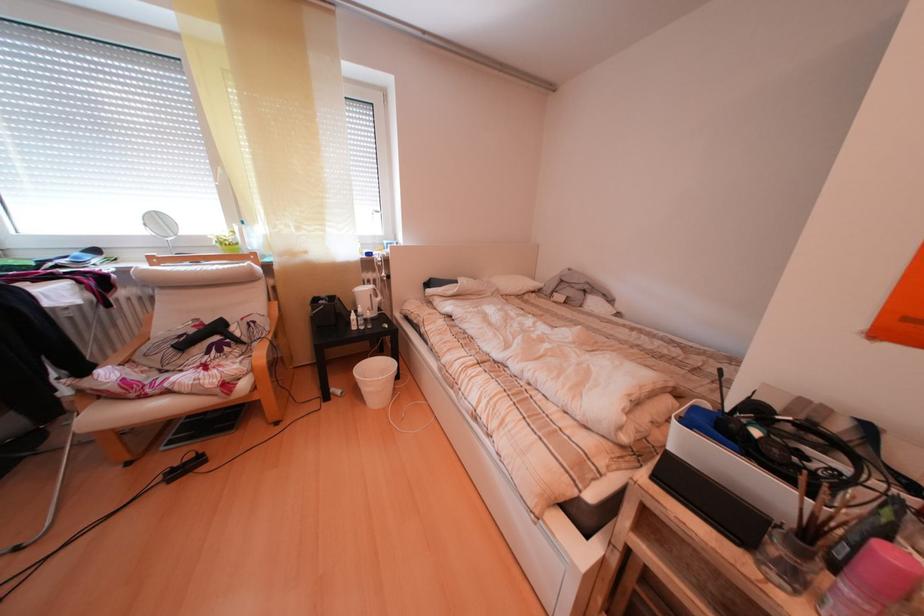
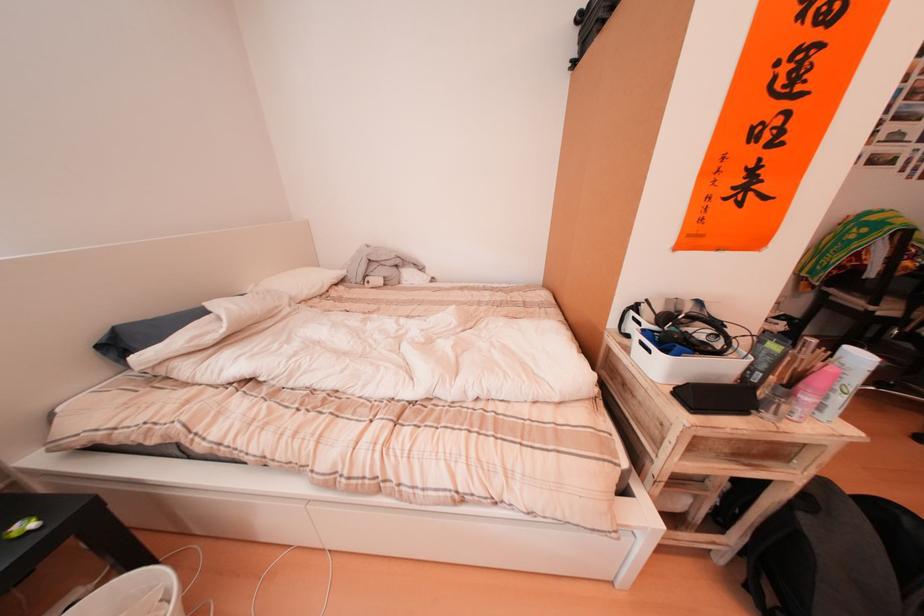
Where in the second image is the point corresponding to the point at 438,285 from the first image?

(105, 339)